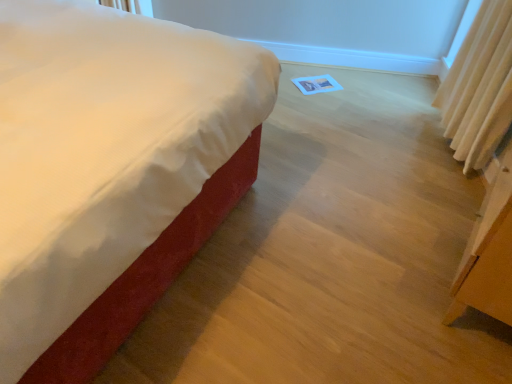
I want to click on unoccupied area in front of beige fabric curtain at right, so pyautogui.click(x=441, y=190).